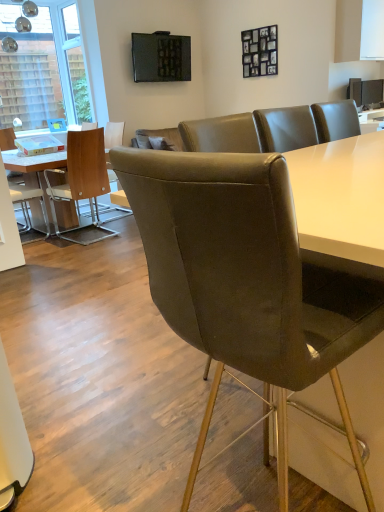
Where is `vacant space situated on the left part of brown leather chair at center, which is counted as the 3th chair, starting from the back`? Image resolution: width=384 pixels, height=512 pixels. vacant space situated on the left part of brown leather chair at center, which is counted as the 3th chair, starting from the back is located at coordinates (102, 357).